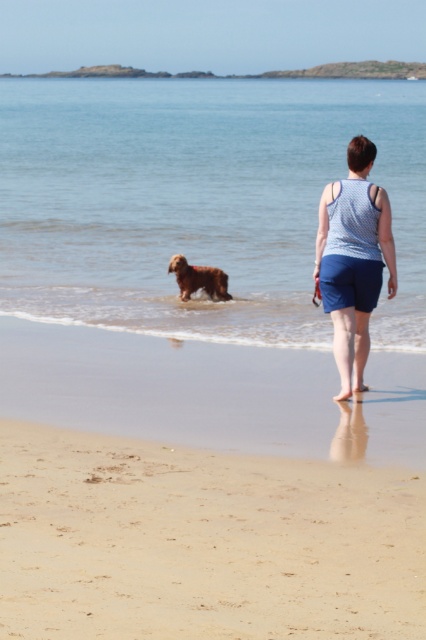
Image resolution: width=426 pixels, height=640 pixels. What do you see at coordinates (199, 200) in the screenshot? I see `clear water at dog center` at bounding box center [199, 200].

Who is taller, clear water at dog center or fine-grained sand at lower center?

With more height is clear water at dog center.

Between point (325, 84) and point (150, 586), which one is positioned in front?

Point (150, 586)

Find the location of a particular element. clear water at dog center is located at coordinates (199, 200).

Is clear water at dog center positioned in front of blue cotton tank top at center?

No.

Is clear water at dog center wider than blue cotton tank top at center?

Yes.

Which is in front, point (308, 320) or point (371, 252)?

Positioned in front is point (371, 252).

Image resolution: width=426 pixels, height=640 pixels. I want to click on clear water at dog center, so click(199, 200).

Does point (112, 540) come behind point (203, 268)?

No, (112, 540) is closer to viewer.

Which of these two, fine-grained sand at lower center or golden brown fur at center, stands taller?

With more height is fine-grained sand at lower center.

Is point (247, 493) positioned before point (212, 275)?

That is True.

Locate an element on the screen. fine-grained sand at lower center is located at coordinates 203,541.